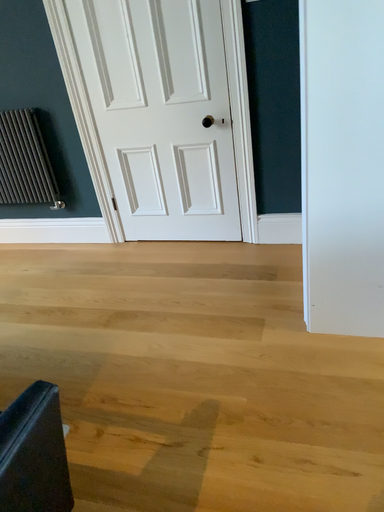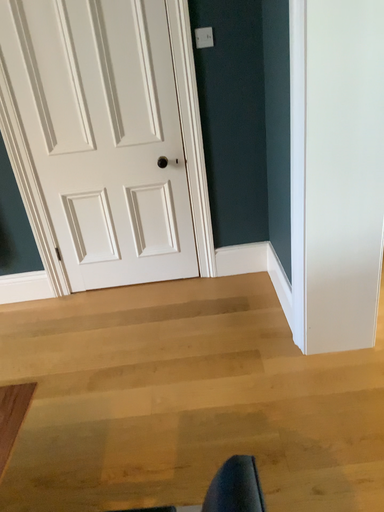
Question: Which way did the camera rotate in the video?

Choices:
 (A) rotated left
 (B) rotated right

Answer: (B)